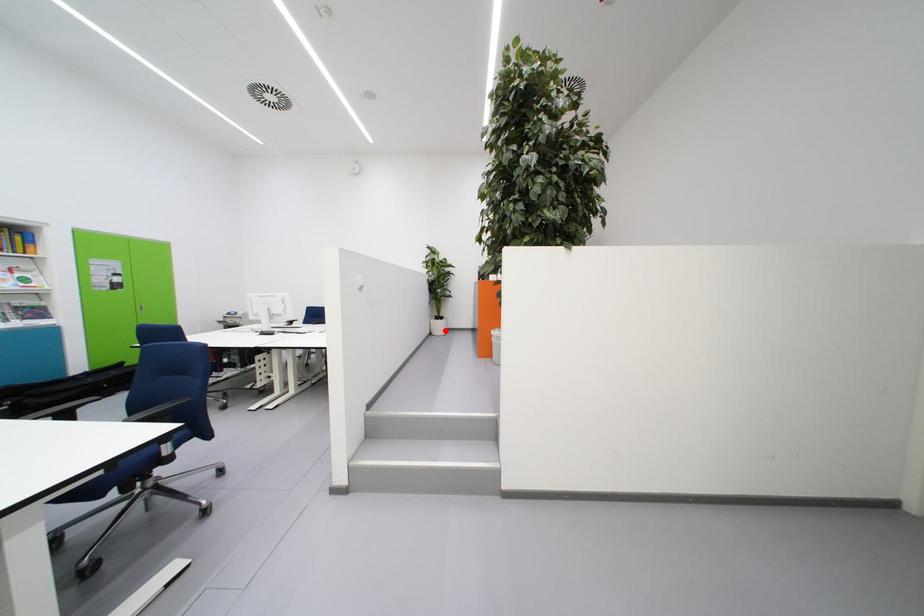
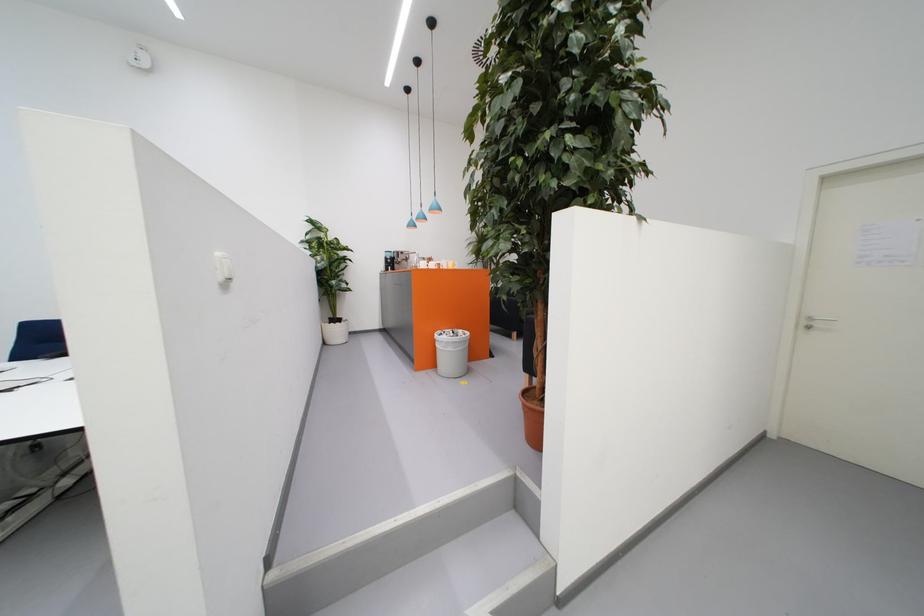
Find the pixel in the second image that matches the highlighted location in the first image.

(344, 336)